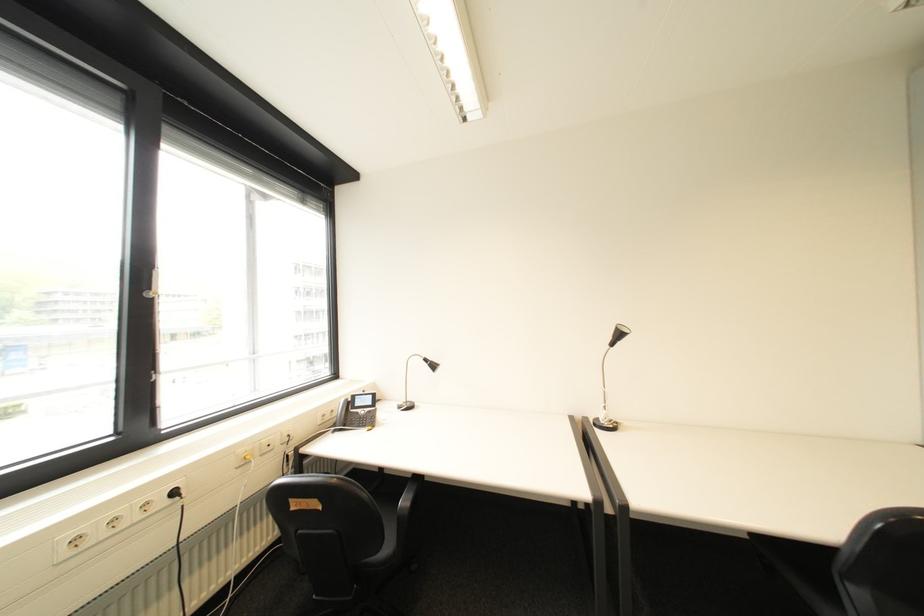
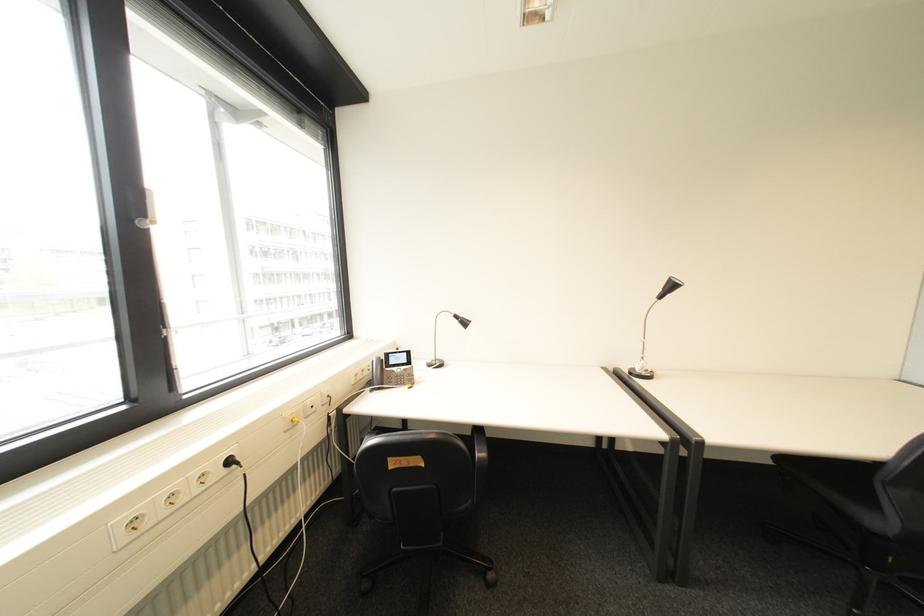
Question: What movement of the cameraman would produce the second image?

Choices:
 (A) Left
 (B) Right
 (C) Forward
 (D) Backward

Answer: (A)